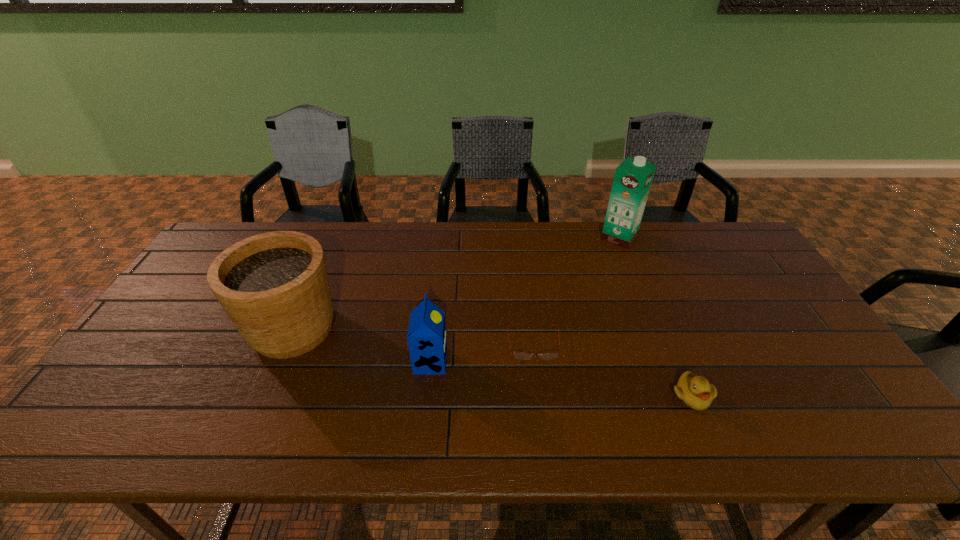
In the image, there is a desktop. What are the coordinates of `vacant area at the right edge` in the screenshot? It's located at (837, 380).

Where is `free space at the far left corner of the desktop`? This screenshot has height=540, width=960. free space at the far left corner of the desktop is located at coordinates (230, 232).

This screenshot has height=540, width=960. In order to click on vacant region at the far right corner of the desktop in this screenshot , I will do `click(727, 228)`.

The image size is (960, 540). Find the location of `empty location between the left carton and the leftmost object`. empty location between the left carton and the leftmost object is located at coordinates (362, 345).

Locate an element on the screen. Image resolution: width=960 pixels, height=540 pixels. free space between the spectacles and the farther carton is located at coordinates (576, 290).

Identify the location of vacant space in between the nearer carton and the duckling. The image size is (960, 540). (x=561, y=379).

Locate an element on the screen. unoccupied position between the nearest object and the leftmost object is located at coordinates [x=492, y=362].

At what (x,y) coordinates should I click in order to perform the action: click on vacant space that is in between the flowerpot and the shorter carton. Please return your answer as a coordinate pair (x, y). Looking at the image, I should click on (362, 345).

At what (x,y) coordinates should I click in order to perform the action: click on free space between the leftmost object and the nearer carton. Please return your answer as a coordinate pair (x, y). Looking at the image, I should click on (362, 345).

At what (x,y) coordinates should I click in order to perform the action: click on free space between the fourth tallest object and the spectacles. Please return your answer as a coordinate pair (x, y). Image resolution: width=960 pixels, height=540 pixels. Looking at the image, I should click on (612, 369).